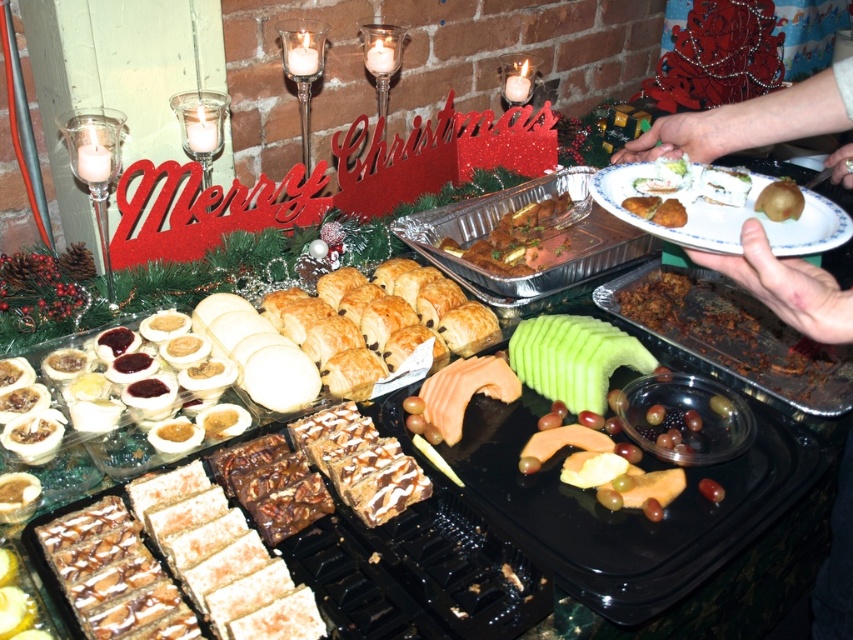
Question: Which of these objects is positioned farthest from the golden brown meat at center?

Choices:
 (A) smooth white plate at center
 (B) green matte kiwi at center
 (C) white glossy plate at upper right

Answer: (B)

Question: Based on their relative distances, which object is nearer to the green matte kiwi at center?

Choices:
 (A) smooth white plate at center
 (B) golden brown meat at center
 (C) white glossy plate at upper right

Answer: (C)

Question: Which object is farther from the camera taking this photo?

Choices:
 (A) smooth white plate at center
 (B) smooth skin hand at upper right
 (C) golden brown meat at center
 (D) white glossy plate at upper right

Answer: (C)

Question: Observing the image, what is the correct spatial positioning of golden brown meat at center in reference to green matte kiwi at center?

Choices:
 (A) above
 (B) below

Answer: (A)

Question: Can you confirm if smooth skin hand at upper right is positioned to the left of smooth white plate at center?

Choices:
 (A) no
 (B) yes

Answer: (B)

Question: In this image, where is smooth skin hand at upper right located relative to golden brown meat at center?

Choices:
 (A) left
 (B) right

Answer: (B)